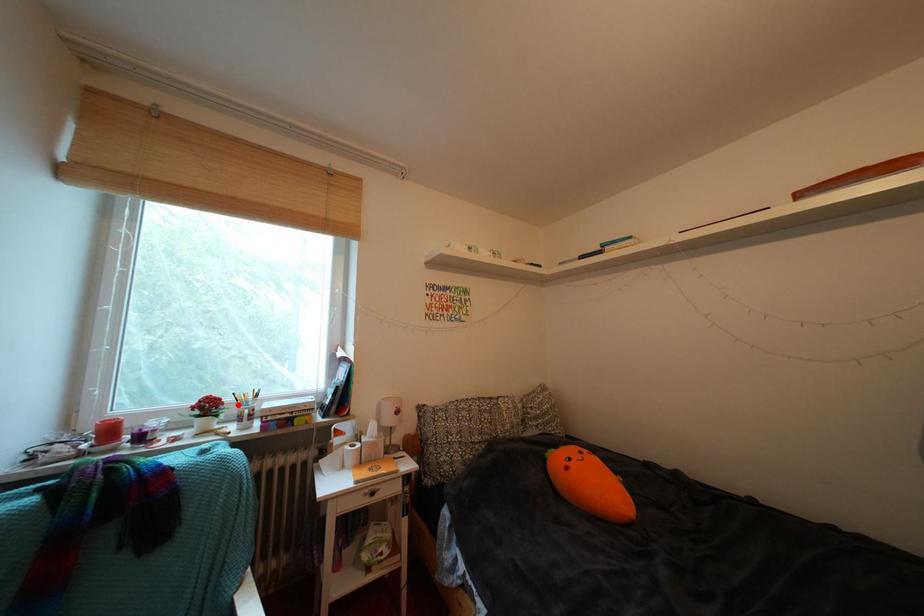
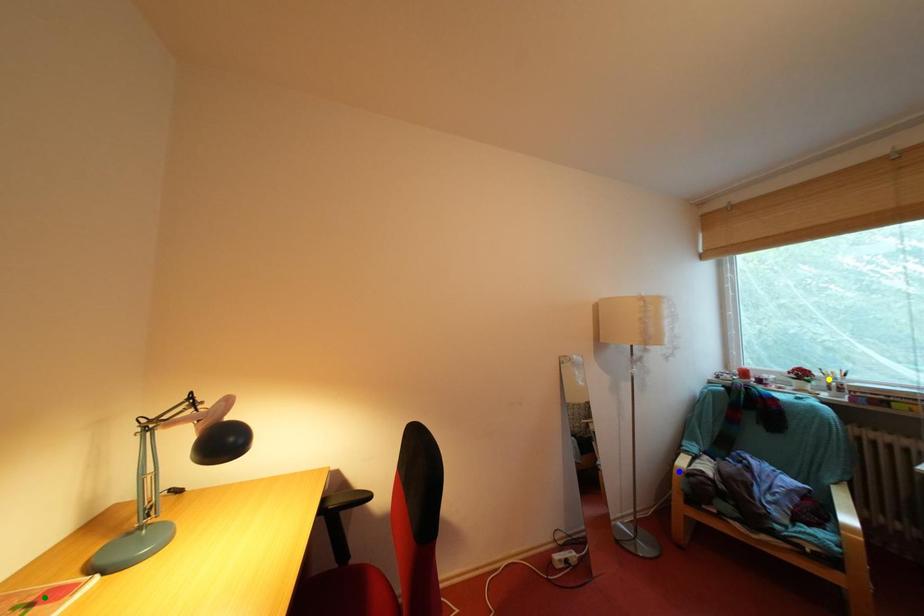
Question: I am providing you with two images of the same scene from different viewpoints. A red point is marked on the first image. You are given multiple points on the second image. Which point in image 2 represents the same 3d spot as the red point in image 1?

Choices:
 (A) blue point
 (B) green point
 (C) yellow point

Answer: (C)